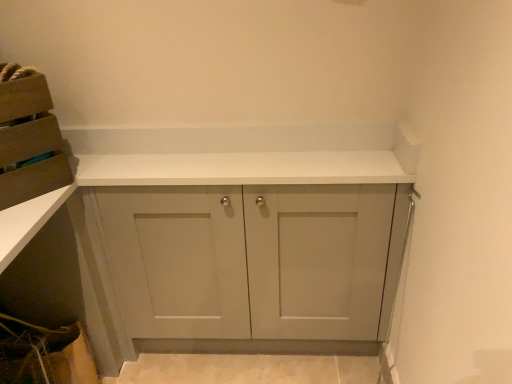
Describe the element at coordinates (28, 138) in the screenshot. I see `matte cardboard box at upper left, placed as the 1th cabinetry when sorted from left to right` at that location.

You are a GUI agent. You are given a task and a screenshot of the screen. Output one action in this format:
    pyautogui.click(x=<x>, y=<y>)
    Task: Click on the matte cardboard box at upper left, placed as the 1th cabinetry when sorted from left to right
    The image size is (512, 384).
    Given the screenshot: What is the action you would take?
    pyautogui.click(x=28, y=138)

What is the approximate height of matte cardboard box at upper left, placed as the 1th cabinetry when sorted from left to right?

It is 13.50 inches.

This screenshot has height=384, width=512. What do you see at coordinates (249, 260) in the screenshot?
I see `white matte cabinet at center, positioned as the second cabinetry in left-to-right order` at bounding box center [249, 260].

Where is `white matte cabinet at center, positioned as the second cabinetry in left-to-right order`? white matte cabinet at center, positioned as the second cabinetry in left-to-right order is located at coordinates (249, 260).

Locate an element on the screen. This screenshot has height=384, width=512. matte cardboard box at upper left, the 2th cabinetry from the right is located at coordinates (28, 138).

Which object is positioned more to the right, matte cardboard box at upper left, placed as the 1th cabinetry when sorted from left to right, or white matte cabinet at center, marked as the first cabinetry in a right-to-left arrangement?

Positioned to the right is white matte cabinet at center, marked as the first cabinetry in a right-to-left arrangement.

In the scene shown: Is matte cardboard box at upper left, placed as the 1th cabinetry when sorted from left to right, positioned in front of white matte cabinet at center, marked as the first cabinetry in a right-to-left arrangement?

Yes, matte cardboard box at upper left, placed as the 1th cabinetry when sorted from left to right, is in front of white matte cabinet at center, marked as the first cabinetry in a right-to-left arrangement.

Is point (35, 137) behind point (265, 316)?

No, (35, 137) is closer to viewer.

From the image's perspective, is matte cardboard box at upper left, the 2th cabinetry from the right, above white matte cabinet at center, positioned as the second cabinetry in left-to-right order?

Indeed, from the image's perspective, matte cardboard box at upper left, the 2th cabinetry from the right, is shown above white matte cabinet at center, positioned as the second cabinetry in left-to-right order.

Based on the photo, from a real-world perspective, between matte cardboard box at upper left, the 2th cabinetry from the right, and white matte cabinet at center, positioned as the second cabinetry in left-to-right order, who is vertically higher?

In real-world perspective, matte cardboard box at upper left, the 2th cabinetry from the right, is above.

Between matte cardboard box at upper left, placed as the 1th cabinetry when sorted from left to right, and white matte cabinet at center, positioned as the second cabinetry in left-to-right order, which one has smaller width?

white matte cabinet at center, positioned as the second cabinetry in left-to-right order.

Who is taller, matte cardboard box at upper left, placed as the 1th cabinetry when sorted from left to right, or white matte cabinet at center, marked as the first cabinetry in a right-to-left arrangement?

With more height is white matte cabinet at center, marked as the first cabinetry in a right-to-left arrangement.

Looking at this image, who is bigger, matte cardboard box at upper left, placed as the 1th cabinetry when sorted from left to right, or white matte cabinet at center, marked as the first cabinetry in a right-to-left arrangement?

Bigger between the two is white matte cabinet at center, marked as the first cabinetry in a right-to-left arrangement.

Based on the photo, is matte cardboard box at upper left, placed as the 1th cabinetry when sorted from left to right, situated inside white matte cabinet at center, positioned as the second cabinetry in left-to-right order, or outside?

matte cardboard box at upper left, placed as the 1th cabinetry when sorted from left to right, cannot be found inside white matte cabinet at center, positioned as the second cabinetry in left-to-right order.

Are matte cardboard box at upper left, placed as the 1th cabinetry when sorted from left to right, and white matte cabinet at center, marked as the first cabinetry in a right-to-left arrangement, located far from each other?

No, matte cardboard box at upper left, placed as the 1th cabinetry when sorted from left to right, is not far away from white matte cabinet at center, marked as the first cabinetry in a right-to-left arrangement.

From the picture: Is matte cardboard box at upper left, placed as the 1th cabinetry when sorted from left to right, turned away from white matte cabinet at center, positioned as the second cabinetry in left-to-right order?

No, white matte cabinet at center, positioned as the second cabinetry in left-to-right order, is not at the back of matte cardboard box at upper left, placed as the 1th cabinetry when sorted from left to right.

How different are the orientations of matte cardboard box at upper left, placed as the 1th cabinetry when sorted from left to right, and white matte cabinet at center, marked as the first cabinetry in a right-to-left arrangement, in degrees?

They differ by 49.5 degrees in their facing directions.

Where is `cabinetry below the matte cardboard box at upper left, placed as the 1th cabinetry when sorted from left to right (from a real-world perspective)`? cabinetry below the matte cardboard box at upper left, placed as the 1th cabinetry when sorted from left to right (from a real-world perspective) is located at coordinates (249, 260).

Considering the relative positions of white matte cabinet at center, positioned as the second cabinetry in left-to-right order, and matte cardboard box at upper left, the 2th cabinetry from the right, in the image provided, is white matte cabinet at center, positioned as the second cabinetry in left-to-right order, to the left of matte cardboard box at upper left, the 2th cabinetry from the right, from the viewer's perspective?

In fact, white matte cabinet at center, positioned as the second cabinetry in left-to-right order, is to the right of matte cardboard box at upper left, the 2th cabinetry from the right.

Which object is further away from the camera, white matte cabinet at center, positioned as the second cabinetry in left-to-right order, or matte cardboard box at upper left, placed as the 1th cabinetry when sorted from left to right?

white matte cabinet at center, positioned as the second cabinetry in left-to-right order, is behind.

Which point is more distant from viewer, (258, 261) or (42, 85)?

Positioned behind is point (258, 261).

From the image's perspective, is white matte cabinet at center, positioned as the second cabinetry in left-to-right order, on matte cardboard box at upper left, the 2th cabinetry from the right?

No, from the image's perspective, white matte cabinet at center, positioned as the second cabinetry in left-to-right order, is not on top of matte cardboard box at upper left, the 2th cabinetry from the right.

From a real-world perspective, is white matte cabinet at center, positioned as the second cabinetry in left-to-right order, located higher than matte cardboard box at upper left, placed as the 1th cabinetry when sorted from left to right?

No.

Considering the relative sizes of white matte cabinet at center, positioned as the second cabinetry in left-to-right order, and matte cardboard box at upper left, the 2th cabinetry from the right, in the image provided, is white matte cabinet at center, positioned as the second cabinetry in left-to-right order, thinner than matte cardboard box at upper left, the 2th cabinetry from the right,?

Indeed, white matte cabinet at center, positioned as the second cabinetry in left-to-right order, has a lesser width compared to matte cardboard box at upper left, the 2th cabinetry from the right.

In terms of height, does white matte cabinet at center, positioned as the second cabinetry in left-to-right order, look taller or shorter compared to matte cardboard box at upper left, placed as the 1th cabinetry when sorted from left to right?

In the image, white matte cabinet at center, positioned as the second cabinetry in left-to-right order, appears to be taller than matte cardboard box at upper left, placed as the 1th cabinetry when sorted from left to right.

Considering the sizes of objects white matte cabinet at center, positioned as the second cabinetry in left-to-right order, and matte cardboard box at upper left, the 2th cabinetry from the right, in the image provided, who is smaller, white matte cabinet at center, positioned as the second cabinetry in left-to-right order, or matte cardboard box at upper left, the 2th cabinetry from the right,?

matte cardboard box at upper left, the 2th cabinetry from the right.

Is white matte cabinet at center, marked as the first cabinetry in a right-to-left arrangement, not inside matte cardboard box at upper left, the 2th cabinetry from the right?

That's correct, white matte cabinet at center, marked as the first cabinetry in a right-to-left arrangement, is outside of matte cardboard box at upper left, the 2th cabinetry from the right.

Is the surface of white matte cabinet at center, marked as the first cabinetry in a right-to-left arrangement, in direct contact with matte cardboard box at upper left, the 2th cabinetry from the right?

white matte cabinet at center, marked as the first cabinetry in a right-to-left arrangement, is not next to matte cardboard box at upper left, the 2th cabinetry from the right, and they're not touching.

In the scene shown: Is white matte cabinet at center, positioned as the second cabinetry in left-to-right order, aimed at matte cardboard box at upper left, the 2th cabinetry from the right?

No, white matte cabinet at center, positioned as the second cabinetry in left-to-right order, does not turn towards matte cardboard box at upper left, the 2th cabinetry from the right.

Measure the distance from white matte cabinet at center, marked as the first cabinetry in a right-to-left arrangement, to matte cardboard box at upper left, the 2th cabinetry from the right.

20.94 inches.

I want to click on cabinetry behind the matte cardboard box at upper left, the 2th cabinetry from the right, so click(x=249, y=260).

Where is `cabinetry on the right side of matte cardboard box at upper left, the 2th cabinetry from the right`? The image size is (512, 384). cabinetry on the right side of matte cardboard box at upper left, the 2th cabinetry from the right is located at coordinates (249, 260).

Find the location of a particular element. cabinetry that is below the matte cardboard box at upper left, the 2th cabinetry from the right (from the image's perspective) is located at coordinates (249, 260).